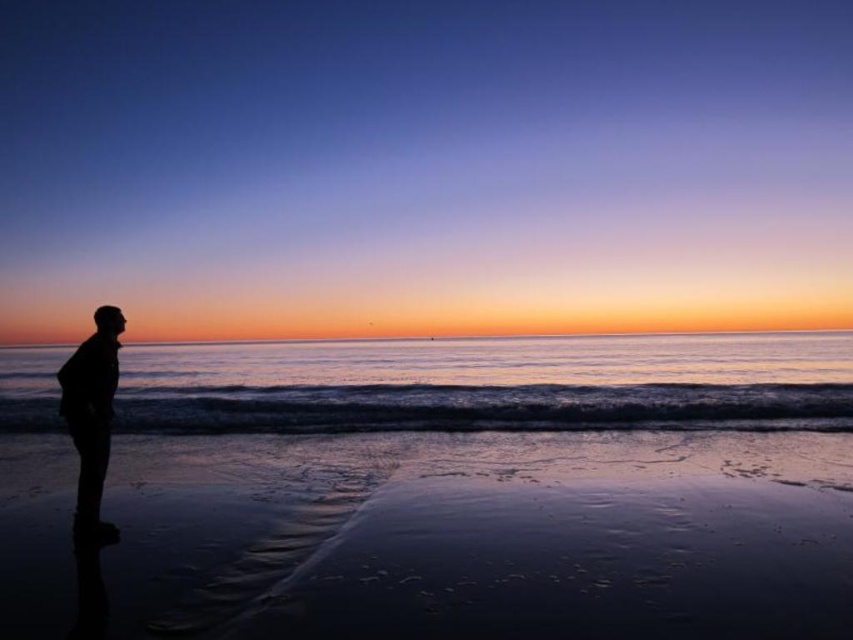
Question: Which point is farther to the camera?

Choices:
 (A) silhouette figure at left
 (B) shiny wet sand at lower center

Answer: (A)

Question: Can you confirm if shiny wet sand at lower center is smaller than silhouette figure at left?

Choices:
 (A) yes
 (B) no

Answer: (B)

Question: Does shiny wet sand at lower center lie behind silhouette figure at left?

Choices:
 (A) yes
 (B) no

Answer: (B)

Question: Is shiny wet sand at lower center to the right of silhouette figure at left from the viewer's perspective?

Choices:
 (A) yes
 (B) no

Answer: (A)